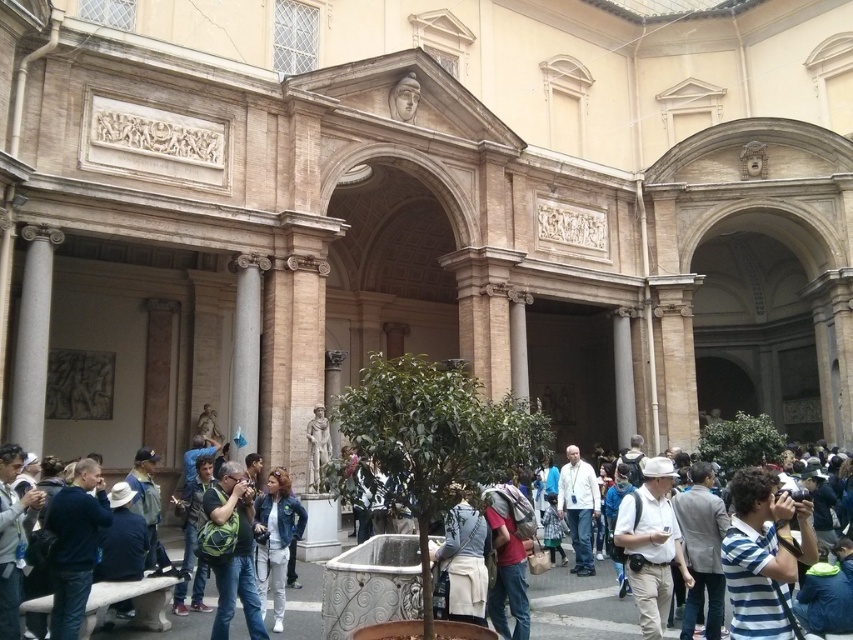
Question: Which of these objects is positioned farthest from the dark blue jacket at center?

Choices:
 (A) white matte hat at center
 (B) matte green backpack at center
 (C) light gray suit at center
 (D) denim jacket at center

Answer: (C)

Question: Does white cotton jacket at center have a smaller size compared to denim jacket at center?

Choices:
 (A) no
 (B) yes

Answer: (B)

Question: Is white matte hat at center above matte green backpack at center?

Choices:
 (A) yes
 (B) no

Answer: (A)

Question: Which of the following is the farthest from the observer?

Choices:
 (A) striped cotton shirt at center
 (B) dark blue shirt at lower left
 (C) matte green backpack at center

Answer: (C)

Question: Does white matte hat at center appear on the left side of dark blue shirt at lower left?

Choices:
 (A) no
 (B) yes

Answer: (A)

Question: Which of the following is the closest to the observer?

Choices:
 (A) (700, 477)
 (B) (51, 579)

Answer: (B)